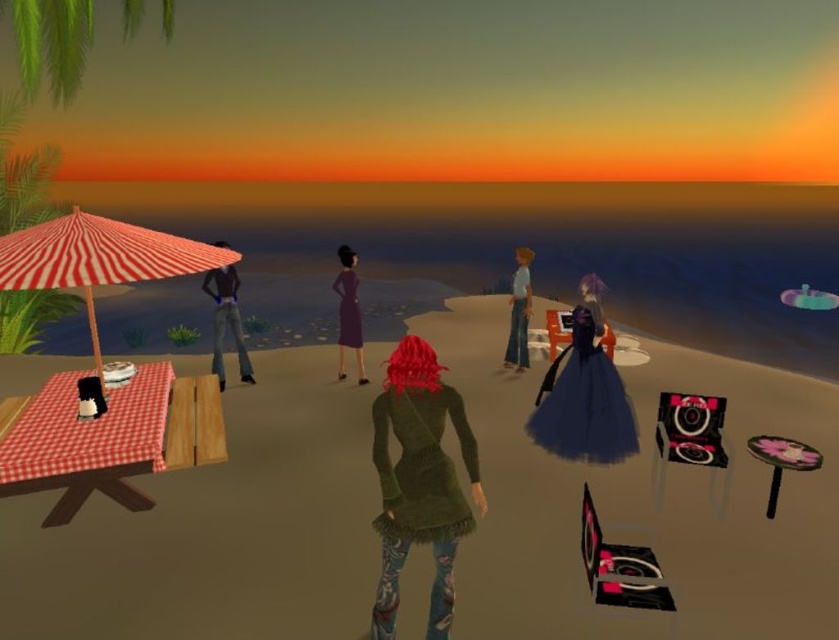
Question: Among these points, which one is nearest to the camera?

Choices:
 (A) (345, 376)
 (B) (215, 465)
 (C) (423, 497)

Answer: (C)

Question: Considering the relative positions of wooden picnic table at left and green fuzzy coat at center in the image provided, where is wooden picnic table at left located with respect to green fuzzy coat at center?

Choices:
 (A) right
 (B) left

Answer: (B)

Question: Does red striped umbrella at left have a greater width compared to matte black shirt at left?

Choices:
 (A) no
 (B) yes

Answer: (B)

Question: Which point is closer to the camera?

Choices:
 (A) (805, 461)
 (B) (519, 349)
 (C) (134, 244)
 (D) (3, 472)

Answer: (D)

Question: Can you confirm if dark blue tulle dress at center is smaller than pink fabric stool at lower right?

Choices:
 (A) yes
 (B) no

Answer: (B)

Question: Which of the following is the farthest from the observer?

Choices:
 (A) red striped umbrella at left
 (B) pink fabric stool at lower right
 (C) blue denim jeans at center

Answer: (C)